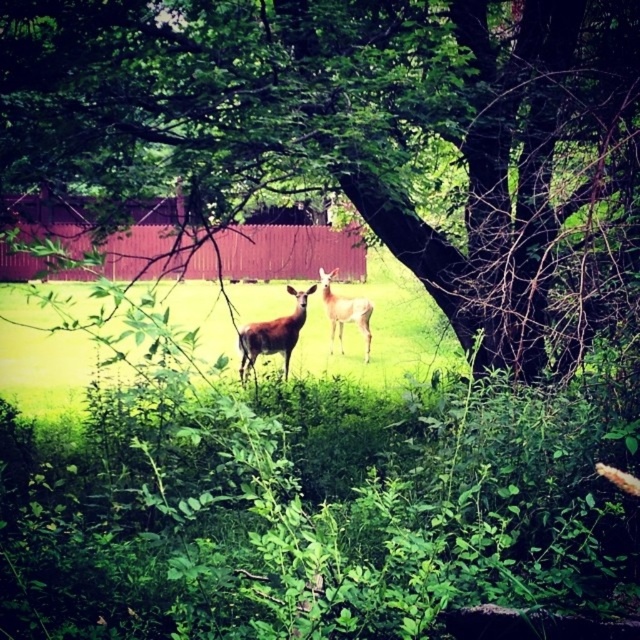
You are a photographer trying to capture a closeup of the green leafy tree at center and the light brown fur at center. Which object should you zoom in on first to ensure it fills the frame properly?

The light brown fur at center is larger than the green leafy tree at center, so you should zoom in on the light brown fur at center first to ensure it fills the frame properly.

Consider the image. You are a photographer trying to capture a photo of both the green leafy tree at center and the brown velvet deer at center. Since you want both subjects to be clearly visible in your shot, which one should you focus on first to ensure depth of field?

You should focus on the brown velvet deer at center first because it is closer to the camera than the green leafy tree at center, ensuring both are in focus when using a small aperture.